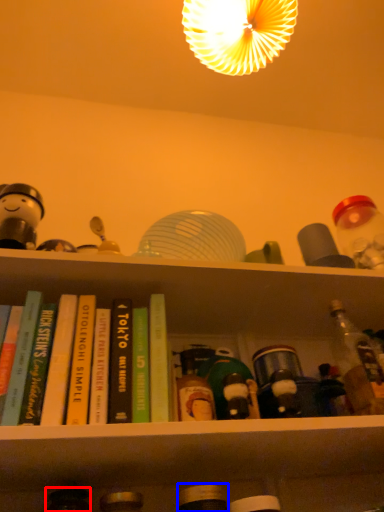
Question: Among these objects, which one is nearest to the camera, bottle (highlighted by a red box) or bottle (highlighted by a blue box)?

Choices:
 (A) bottle
 (B) bottle

Answer: (B)